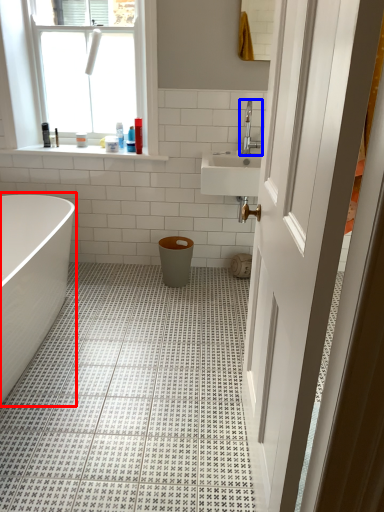
Question: Which of the following is the closest to the observer, bathtub (highlighted by a red box) or tap (highlighted by a blue box)?

Choices:
 (A) bathtub
 (B) tap

Answer: (A)